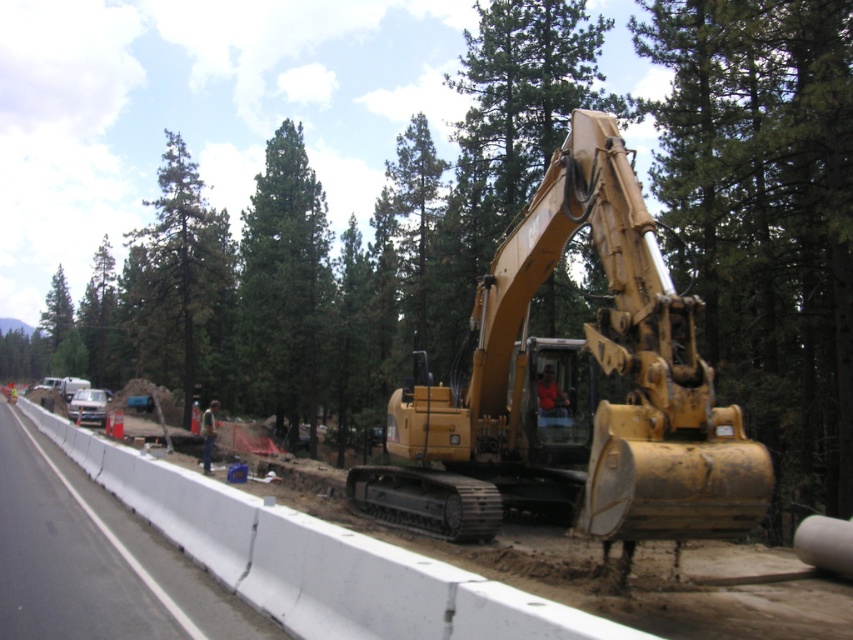
Does yellow tracked excavator at center appear on the left side of green textured tree at upper left?

Incorrect, yellow tracked excavator at center is not on the left side of green textured tree at upper left.

Is yellow tracked excavator at center positioned at the back of green textured tree at upper left?

No, yellow tracked excavator at center is in front of green textured tree at upper left.

Between point (613, 618) and point (175, 262), which one is positioned behind?

Point (175, 262)

Locate an element on the screen. This screenshot has width=853, height=640. yellow tracked excavator at center is located at coordinates (97, 557).

Does yellow metallic excavator at center appear over white concrete barrier at lower left?

Correct, yellow metallic excavator at center is located above white concrete barrier at lower left.

Between point (622, 358) and point (131, 547), which one is positioned in front?

Point (622, 358)

The image size is (853, 640). Describe the element at coordinates (573, 387) in the screenshot. I see `yellow metallic excavator at center` at that location.

The width and height of the screenshot is (853, 640). I want to click on yellow metallic excavator at center, so click(x=573, y=387).

Who is positioned more to the left, yellow metallic excavator at center or green matte tree at center?

Positioned to the left is green matte tree at center.

Is point (694, 369) positioned after point (259, 401)?

No.

This screenshot has width=853, height=640. Find the location of `yellow metallic excavator at center`. yellow metallic excavator at center is located at coordinates (573, 387).